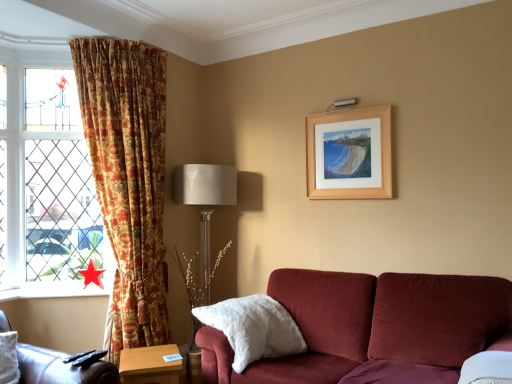
Question: Would you say white fluffy pillow at lower center is inside or outside stained glass window at left?

Choices:
 (A) outside
 (B) inside

Answer: (A)

Question: Visually, is white fluffy pillow at lower center positioned to the left or to the right of stained glass window at left?

Choices:
 (A) right
 (B) left

Answer: (A)

Question: Estimate the real-world distances between objects in this image. Which object is closer to the floral fabric curtain at left?

Choices:
 (A) stained glass window at left
 (B) red paper star at lower left
 (C) wooden table at lower center
 (D) wooden picture frame at upper right
 (E) leather at left

Answer: (A)

Question: Based on their relative distances, which object is nearer to the wooden table at lower center?

Choices:
 (A) stained glass window at left
 (B) wooden picture frame at upper right
 (C) red paper star at lower left
 (D) satin beige lampshade at center
 (E) leather at left

Answer: (E)